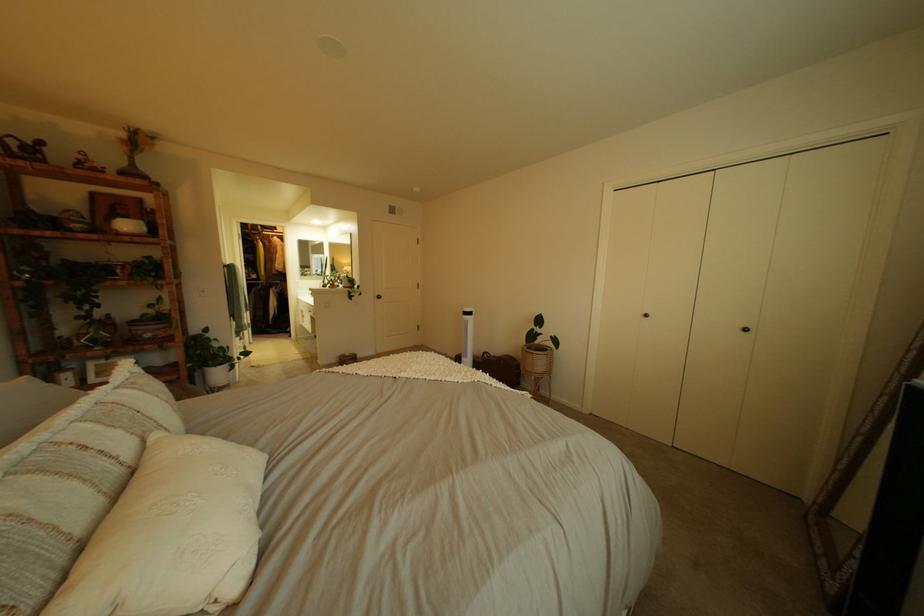
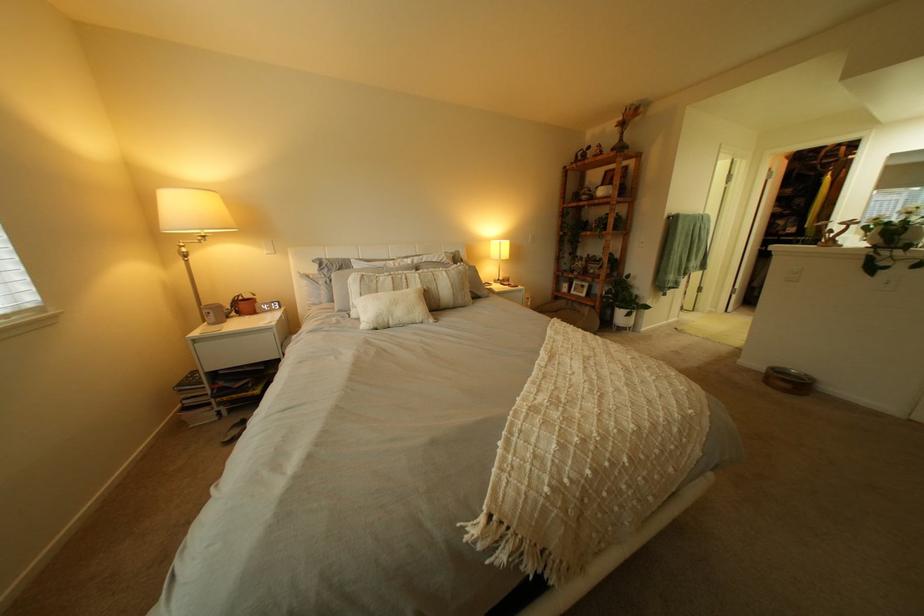
Find the pixel in the second image that matches point (348, 362) in the first image.

(779, 369)